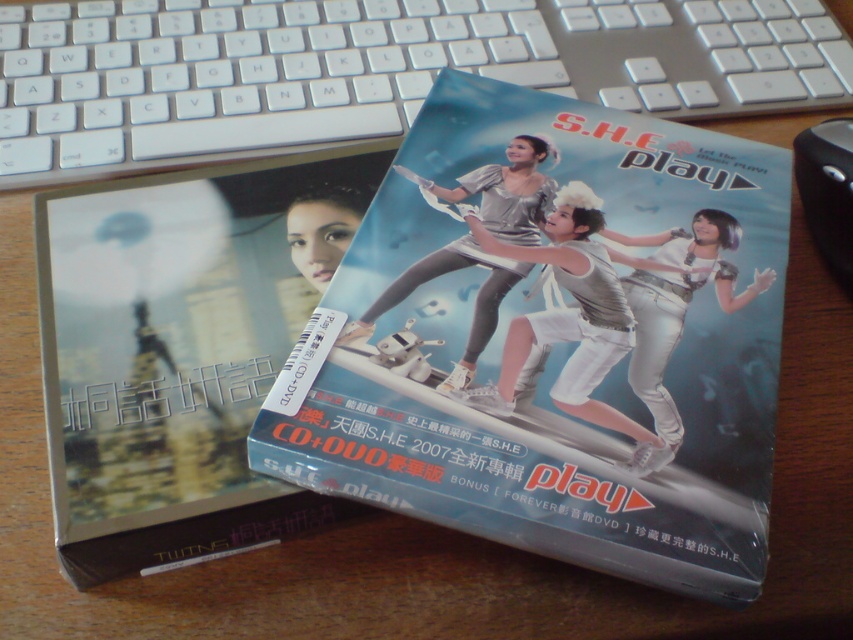
Question: Which object is positioned farthest from the matte silver cd+dvd at center?

Choices:
 (A) silver metallic keyboard at upper center
 (B) black plastic mouse at upper right

Answer: (A)

Question: Observing the image, what is the correct spatial positioning of matte silver cd+dvd at center in reference to matte black book at left?

Choices:
 (A) right
 (B) left

Answer: (A)

Question: Where is matte silver cd+dvd at center located in relation to matte black book at left in the image?

Choices:
 (A) above
 (B) below

Answer: (A)

Question: Can you confirm if silver metallic keyboard at upper center is positioned below black plastic mouse at upper right?

Choices:
 (A) yes
 (B) no

Answer: (B)

Question: Among these points, which one is nearest to the camera?

Choices:
 (A) (838, 243)
 (B) (234, 22)
 (C) (184, 557)

Answer: (C)

Question: Which object appears farthest from the camera in this image?

Choices:
 (A) silver metallic keyboard at upper center
 (B) matte silver cd+dvd at center
 (C) matte black book at left
 (D) black plastic mouse at upper right

Answer: (A)